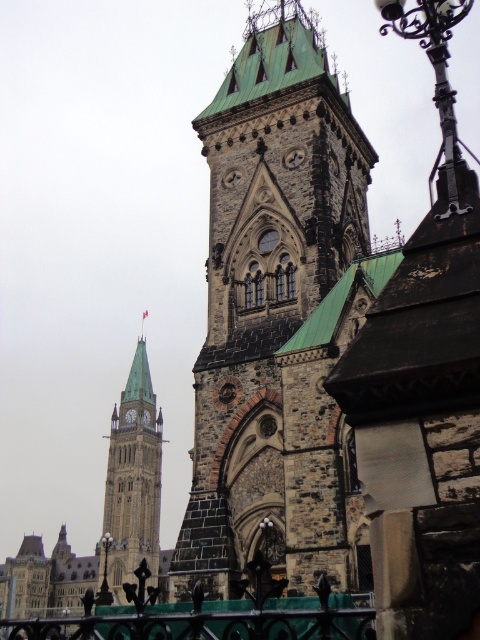
Consider the image. Does green wrought iron fence at lower center have a greater height compared to green copper clock tower at left?

No, green wrought iron fence at lower center is not taller than green copper clock tower at left.

Can you confirm if green wrought iron fence at lower center is positioned below green copper clock tower at left?

No.

I want to click on green wrought iron fence at lower center, so click(207, 621).

Is the position of dark gray stone tower at center less distant than that of green copper clock tower at left?

Yes, it is in front of green copper clock tower at left.

Which is behind, point (228, 396) or point (144, 465)?

The point (144, 465) is behind.

The height and width of the screenshot is (640, 480). What do you see at coordinates (277, 317) in the screenshot?
I see `dark gray stone tower at center` at bounding box center [277, 317].

I want to click on dark gray stone tower at center, so click(277, 317).

Is dark gray stone tower at center to the right of green wrought iron fence at lower center from the viewer's perspective?

Indeed, dark gray stone tower at center is positioned on the right side of green wrought iron fence at lower center.

Is dark gray stone tower at center above green wrought iron fence at lower center?

Correct, dark gray stone tower at center is located above green wrought iron fence at lower center.

Where is `dark gray stone tower at center`? The height and width of the screenshot is (640, 480). dark gray stone tower at center is located at coordinates (277, 317).